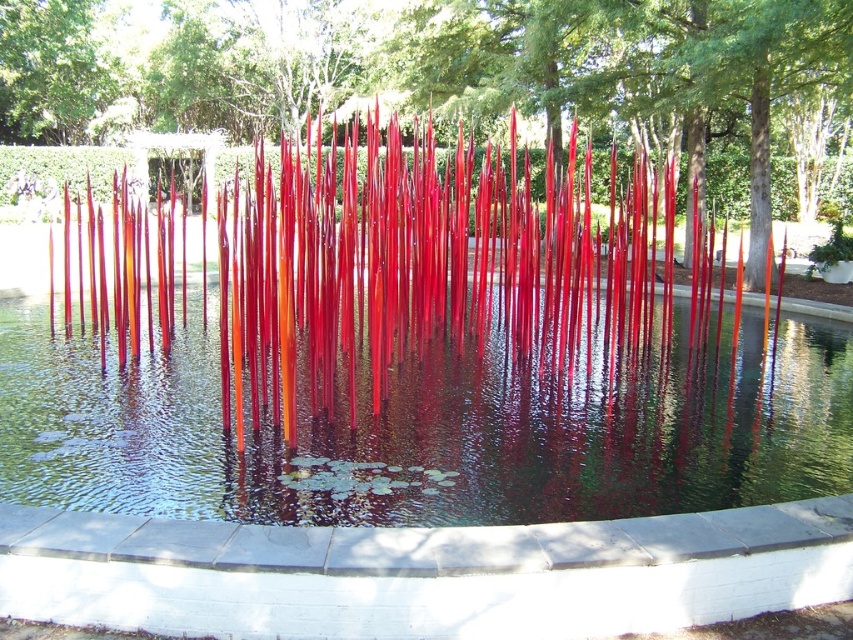
Does transparent glass water at center appear under glossy glass sculpture at center?

Yes.

Which of these two, transparent glass water at center or glossy glass sculpture at center, stands shorter?

transparent glass water at center is shorter.

At what (x,y) coordinates should I click in order to perform the action: click on transparent glass water at center. Please return your answer as a coordinate pair (x, y). This screenshot has height=640, width=853. Looking at the image, I should click on (430, 432).

Image resolution: width=853 pixels, height=640 pixels. Find the location of `transparent glass water at center`. transparent glass water at center is located at coordinates coord(430,432).